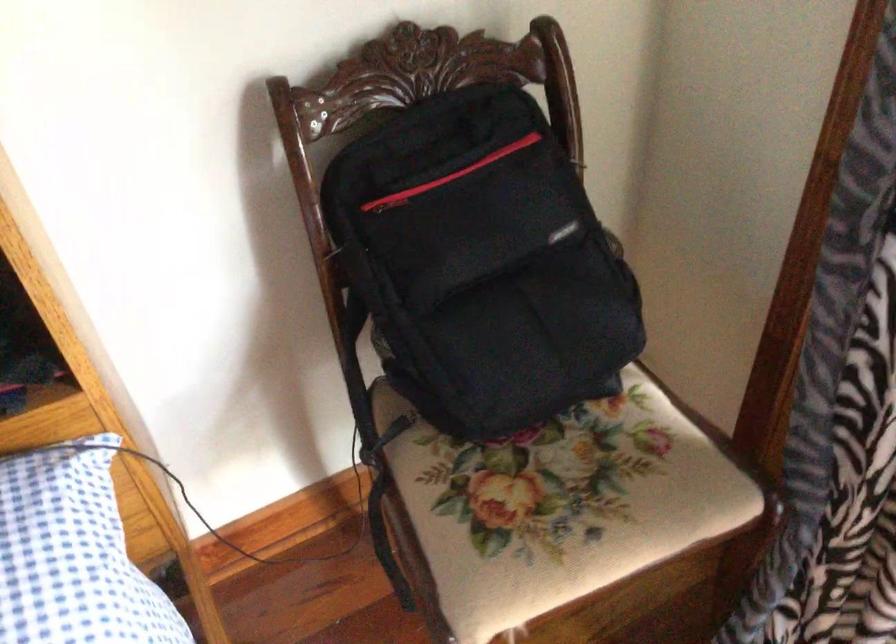
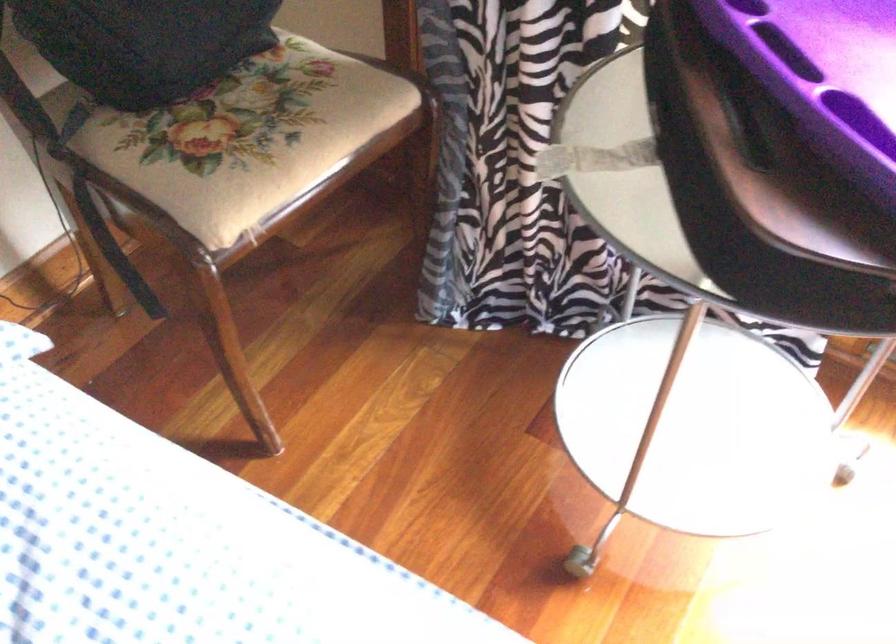
Where in the second image is the point corresponding to (554,533) from the first image?

(259, 145)